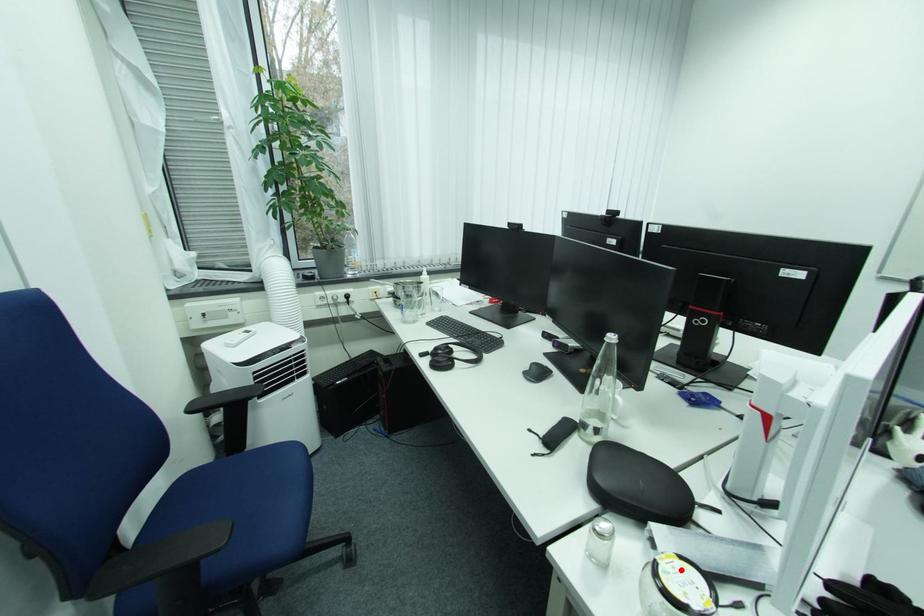
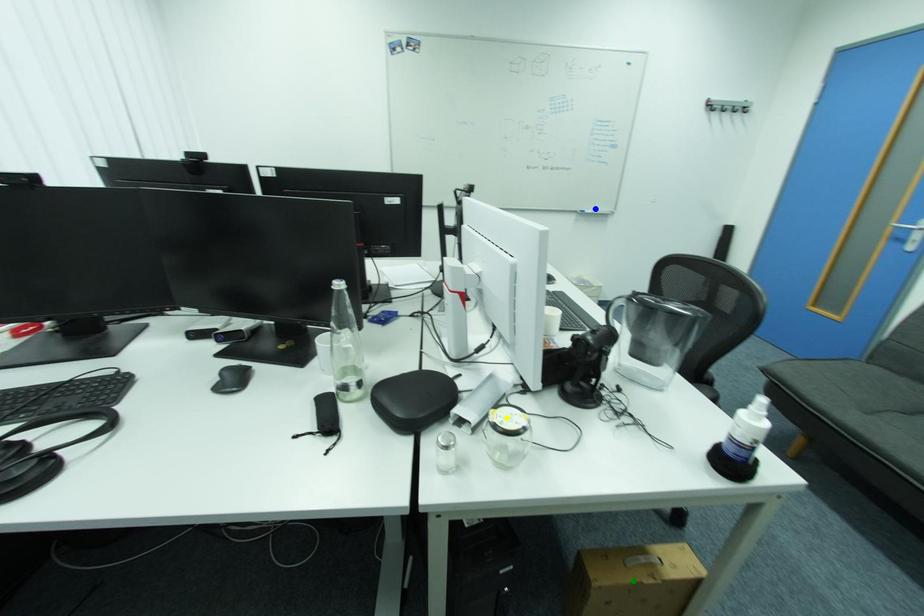
Question: I am providing you with two images of the same scene from different viewpoints. A red point is marked on the first image. You are given multiple points on the second image. Which point in image 2 represents the same 3d spot as the red point in image 1?

Choices:
 (A) blue point
 (B) yellow point
 (C) green point

Answer: (B)